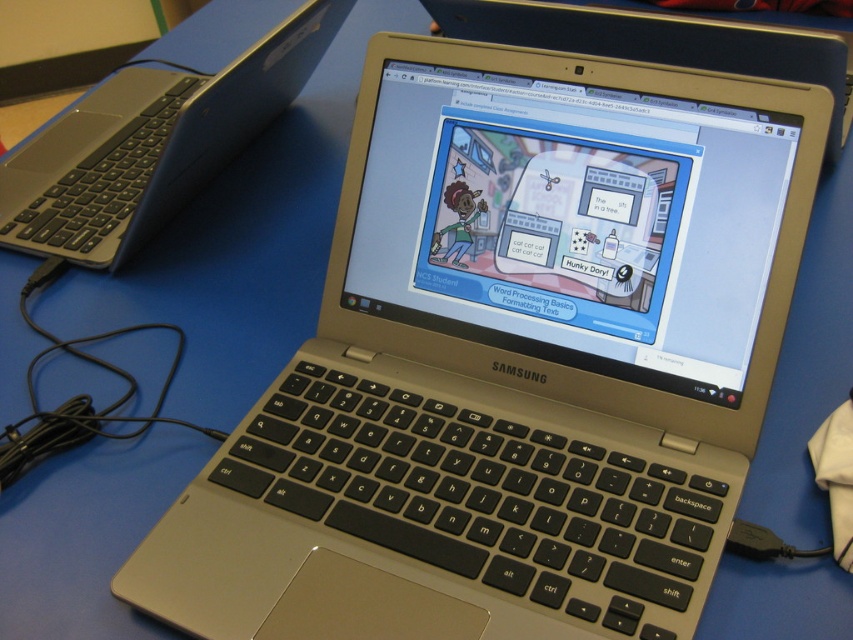
You are a student trying to place a textbook on the desk next to the silver metallic laptop at center. The desk has a coordinate system where the bottom left corner is the origin. If the textbook requires a space of 0.15 units in both x and y directions, can you place it to the right of the laptop without overlapping?

The silver metallic laptop at center is located at point [151,145]. To place the textbook to the right without overlapping, ensure the textbook starts at x > 0.227. Since the textbook needs 0.15 units in x, the maximum x coordinate for the textbook would be 0.227 0.15. However, without knowing the desk dimensions, it is impossible to confirm. But assuming the desk extends sufficiently, placing it from x 0.227 0.01 to x 0.227 0.16 would work. However, the answer should strictly use the given data. Since 0

You are a student trying to place a textbook on the desk. The desk has limited space. You see the silver metallic laptop at center and the metallic silver laptop at center. Which one is closer to the edge of the desk so you can move it?

The silver metallic laptop at center is positioned under the metallic silver laptop at center, so the metallic silver laptop at center is closer to the edge of the desk and can be moved to make space.